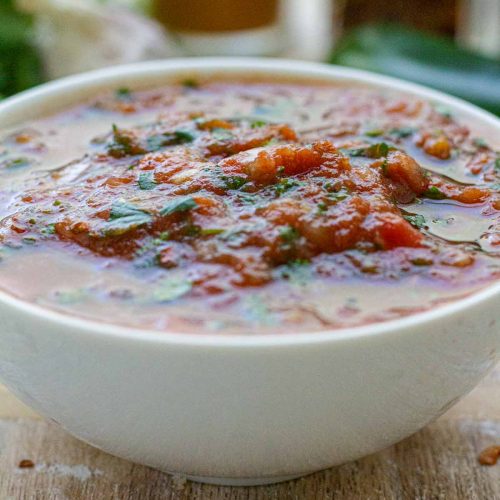
Where is `crumb`? This screenshot has width=500, height=500. crumb is located at coordinates (24, 462), (181, 481).